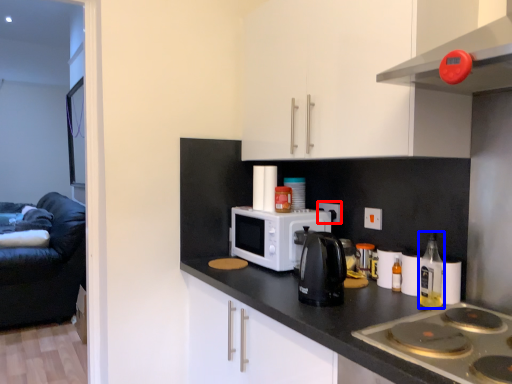
Question: Which of the following is the farthest to the observer, electric outlet (highlighted by a red box) or bottle (highlighted by a blue box)?

Choices:
 (A) electric outlet
 (B) bottle

Answer: (A)